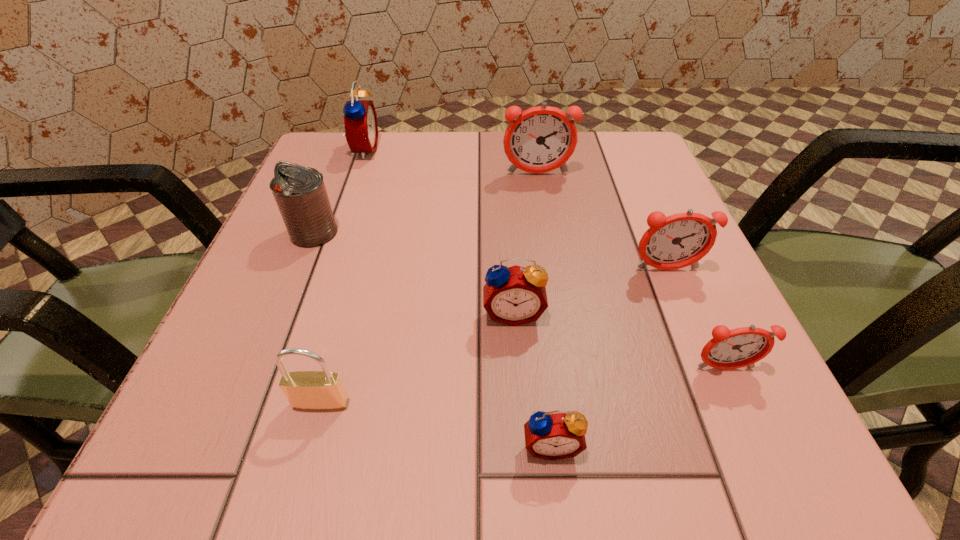
Locate which red alarm clock ranks third in proximity to the can. Please provide its 2D coordinates. Your answer should be formatted as a tuple, i.e. [(x, y)], where the tuple contains the x and y coordinates of a point satisfying the conditions above.

[(555, 435)]

Point out which red alarm clock is positioned as the second nearest to the sixth farthest object. Please provide its 2D coordinates. Your answer should be formatted as a tuple, i.e. [(x, y)], where the tuple contains the x and y coordinates of a point satisfying the conditions above.

[(515, 295)]

I want to click on reddish-pink alarm clock that is the closest to the brass padlock, so click(728, 349).

Find the location of a particular element. This screenshot has width=960, height=540. the closest reddish-pink alarm clock to the fourth nearest object is located at coordinates (680, 240).